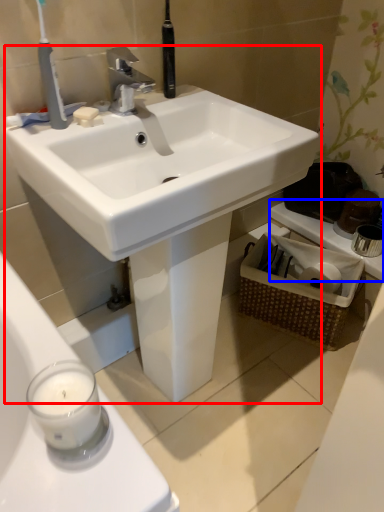
Question: Which object appears farthest to the camera in this image, sink (highlighted by a red box) or counter top (highlighted by a blue box)?

Choices:
 (A) sink
 (B) counter top

Answer: (B)